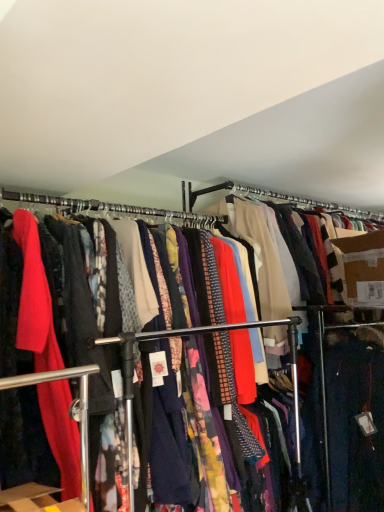
Locate an element on the screen. printed cotton pants at center is located at coordinates (164, 431).

Describe the element at coordinates (164, 431) in the screenshot. I see `printed cotton pants at center` at that location.

The width and height of the screenshot is (384, 512). I want to click on printed cotton pants at center, so click(x=164, y=431).